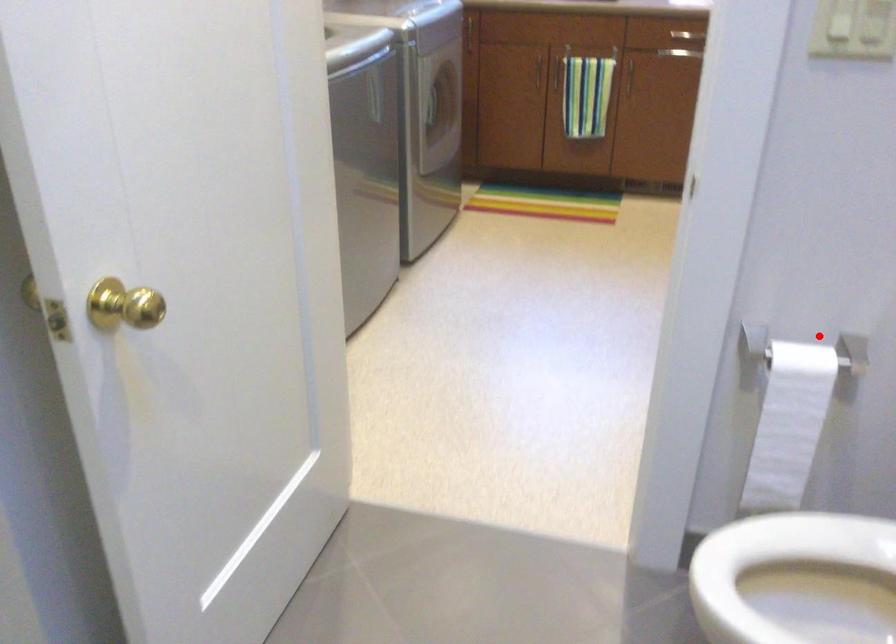
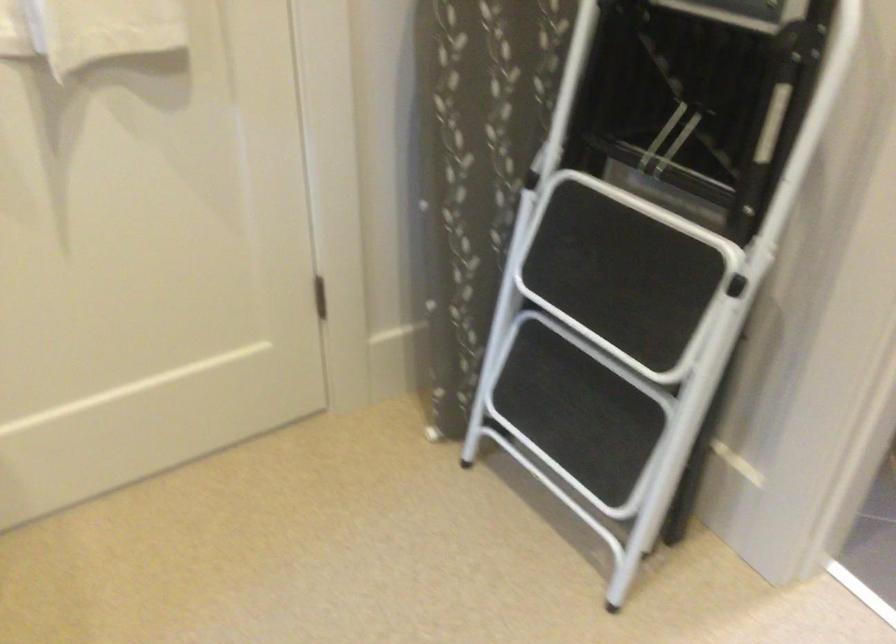
Question: I am providing you with two images of the same scene from different viewpoints. A red point is shown in image1. For the corresponding object point in image2, is it positioned nearer or farther from the camera?

Choices:
 (A) Nearer
 (B) Farther

Answer: (A)